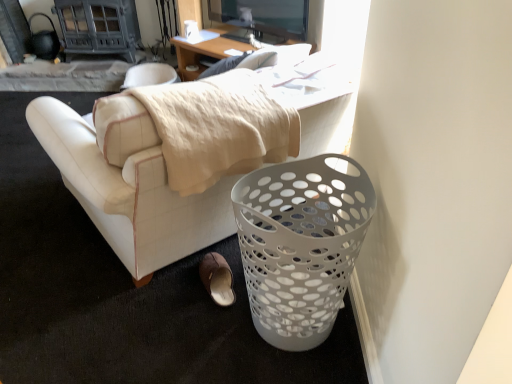
Locate an element on the screen. space that is in front of brown suede slipper at lower center is located at coordinates (207, 322).